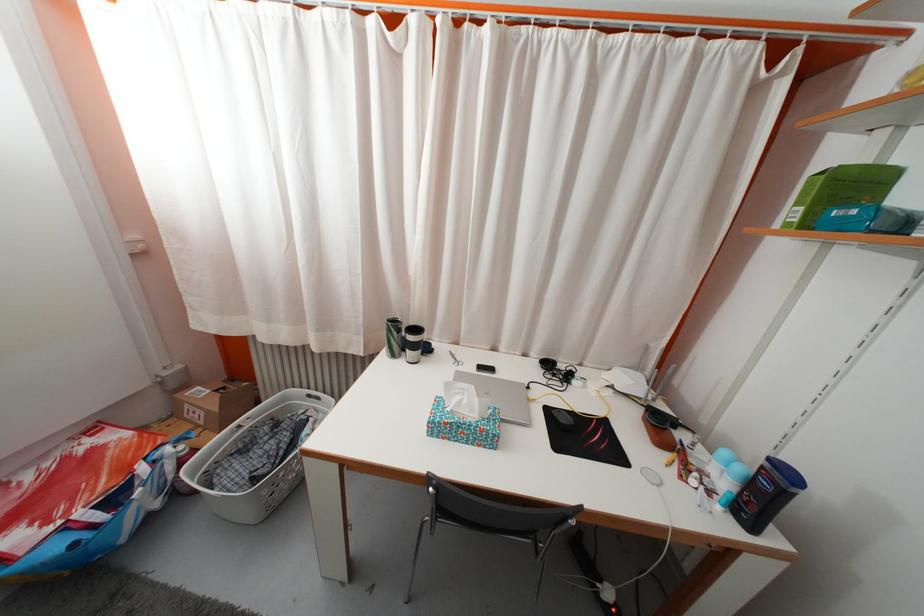
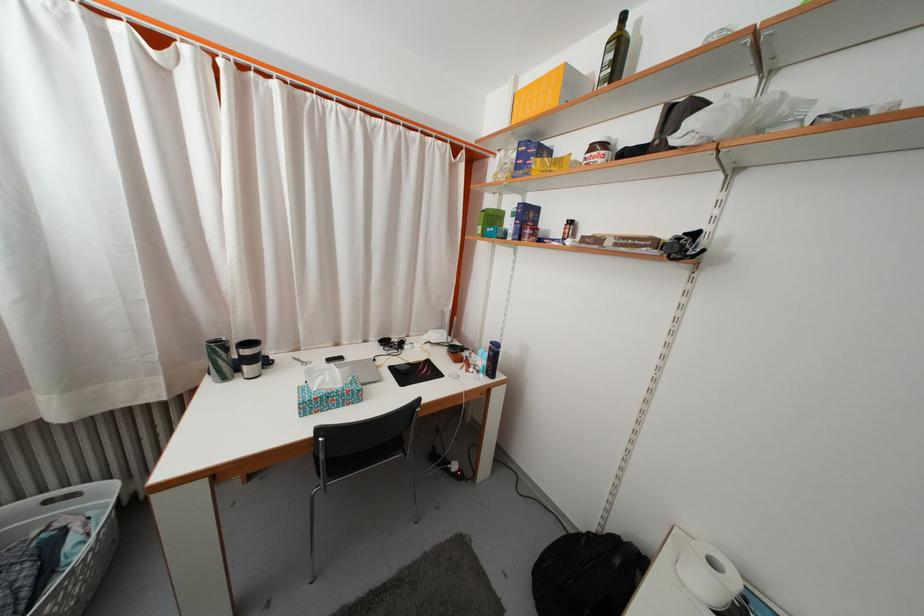
Locate, in the second image, the point that corresponds to point (439, 430) in the first image.

(310, 410)